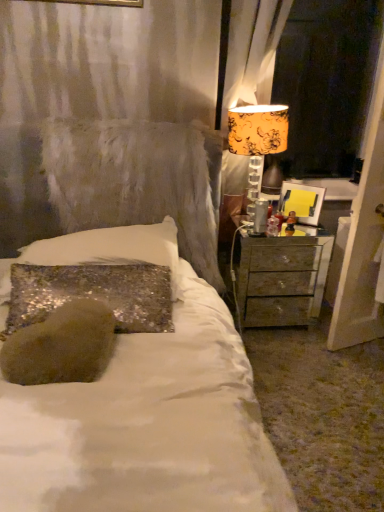
Question: Is orange floral fabric lampshade at upper right positioned in front of metallic silver nightstand at right?

Choices:
 (A) yes
 (B) no

Answer: (A)

Question: Considering the relative sizes of orange floral fabric lampshade at upper right and metallic silver nightstand at right in the image provided, is orange floral fabric lampshade at upper right smaller than metallic silver nightstand at right?

Choices:
 (A) no
 (B) yes

Answer: (B)

Question: Can you confirm if orange floral fabric lampshade at upper right is shorter than metallic silver nightstand at right?

Choices:
 (A) no
 (B) yes

Answer: (A)

Question: Does orange floral fabric lampshade at upper right appear on the left side of metallic silver nightstand at right?

Choices:
 (A) yes
 (B) no

Answer: (A)

Question: Is orange floral fabric lampshade at upper right further to the viewer compared to metallic silver nightstand at right?

Choices:
 (A) no
 (B) yes

Answer: (A)

Question: Is orange floral fabric at right situated inside yellow paper at right or outside?

Choices:
 (A) inside
 (B) outside

Answer: (B)

Question: Would you say orange floral fabric at right is to the left or to the right of yellow paper at right in the picture?

Choices:
 (A) left
 (B) right

Answer: (B)

Question: Considering the positions of point (362, 110) and point (314, 218), is point (362, 110) closer or farther from the camera than point (314, 218)?

Choices:
 (A) closer
 (B) farther

Answer: (B)

Question: Is orange floral fabric at right in front of or behind yellow paper at right in the image?

Choices:
 (A) front
 (B) behind

Answer: (A)

Question: From a real-world perspective, relative to yellow paper at right, is metallic silver nightstand at right vertically above or below?

Choices:
 (A) above
 (B) below

Answer: (B)

Question: Would you say metallic silver nightstand at right is to the left or to the right of yellow paper at right in the picture?

Choices:
 (A) left
 (B) right

Answer: (A)

Question: Considering the positions of metallic silver nightstand at right and yellow paper at right in the image, is metallic silver nightstand at right bigger or smaller than yellow paper at right?

Choices:
 (A) big
 (B) small

Answer: (A)

Question: Relative to yellow paper at right, is metallic silver nightstand at right in front or behind?

Choices:
 (A) front
 (B) behind

Answer: (A)

Question: Considering the relative positions of sparkly silver pillow at center and metallic silver nightstand at right in the image provided, is sparkly silver pillow at center to the left or to the right of metallic silver nightstand at right?

Choices:
 (A) right
 (B) left

Answer: (B)

Question: In terms of height, does sparkly silver pillow at center look taller or shorter compared to metallic silver nightstand at right?

Choices:
 (A) tall
 (B) short

Answer: (B)